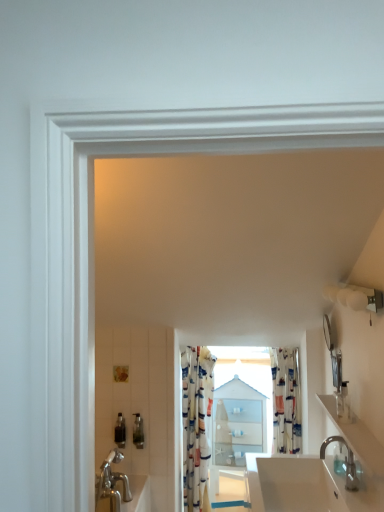
Question: Should I look upward or downward to see translucent plastic soap dispenser at lower left, positioned as the 1th toiletry in back-to-front order?

Choices:
 (A) up
 (B) down

Answer: (B)

Question: Could you tell me if white glossy countertop at lower right is turned towards white glossy sink at lower center?

Choices:
 (A) no
 (B) yes

Answer: (A)

Question: Considering the relative sizes of white glossy countertop at lower right and white glossy sink at lower center in the image provided, is white glossy countertop at lower right wider than white glossy sink at lower center?

Choices:
 (A) no
 (B) yes

Answer: (A)

Question: Is white glossy countertop at lower right located outside white glossy sink at lower center?

Choices:
 (A) no
 (B) yes

Answer: (B)

Question: Does white glossy countertop at lower right appear on the right side of white glossy sink at lower center?

Choices:
 (A) yes
 (B) no

Answer: (A)

Question: Does white glossy countertop at lower right have a greater height compared to white glossy sink at lower center?

Choices:
 (A) yes
 (B) no

Answer: (B)

Question: Considering the relative positions of white glossy countertop at lower right and white glossy sink at lower center in the image provided, is white glossy countertop at lower right in front of white glossy sink at lower center?

Choices:
 (A) yes
 (B) no

Answer: (A)

Question: Does glossy metallic mirror at upper right have a lesser width compared to silver metallic faucet at lower right?

Choices:
 (A) no
 (B) yes

Answer: (B)

Question: Can you confirm if glossy metallic mirror at upper right is positioned to the left of silver metallic faucet at lower right?

Choices:
 (A) no
 (B) yes

Answer: (A)

Question: Does glossy metallic mirror at upper right turn towards silver metallic faucet at lower right?

Choices:
 (A) no
 (B) yes

Answer: (A)

Question: Is glossy metallic mirror at upper right smaller than silver metallic faucet at lower right?

Choices:
 (A) yes
 (B) no

Answer: (A)

Question: Would you say silver metallic faucet at lower right is part of glossy metallic mirror at upper right's contents?

Choices:
 (A) yes
 (B) no

Answer: (B)

Question: Does glossy metallic mirror at upper right come behind silver metallic faucet at lower right?

Choices:
 (A) no
 (B) yes

Answer: (B)

Question: Is silver metallic faucet at lower right closer to the viewer compared to white glossy countertop at lower right?

Choices:
 (A) yes
 (B) no

Answer: (B)